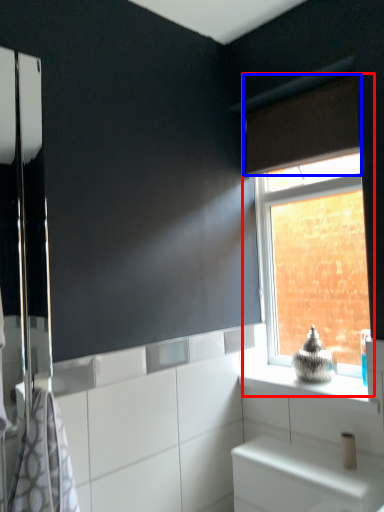
Question: Which point is further to the camera, window (highlighted by a red box) or curtain (highlighted by a blue box)?

Choices:
 (A) window
 (B) curtain

Answer: (A)